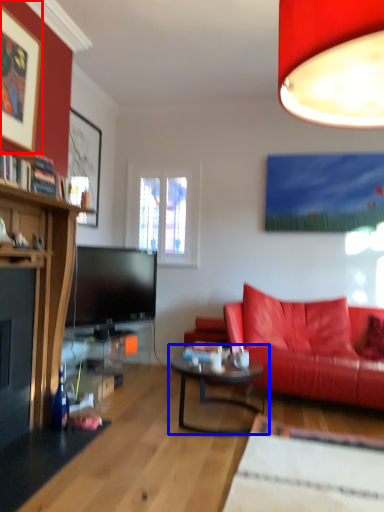
Question: Among these objects, which one is nearest to the camera, picture frame (highlighted by a red box) or coffee table (highlighted by a blue box)?

Choices:
 (A) picture frame
 (B) coffee table

Answer: (A)